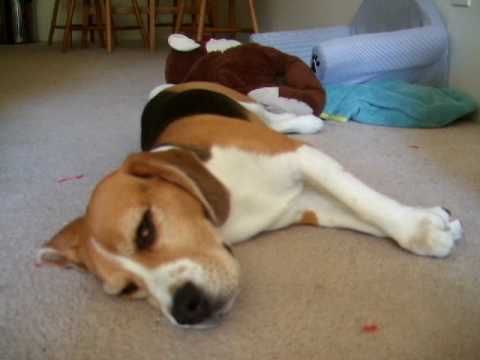
Where is `floor`? The width and height of the screenshot is (480, 360). floor is located at coordinates (52, 320), (411, 293), (405, 154), (83, 98).